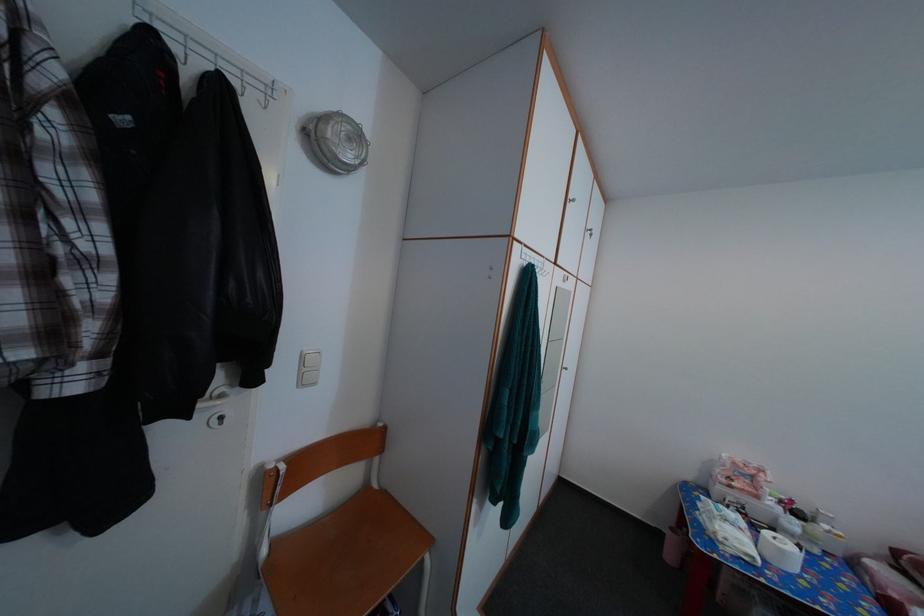
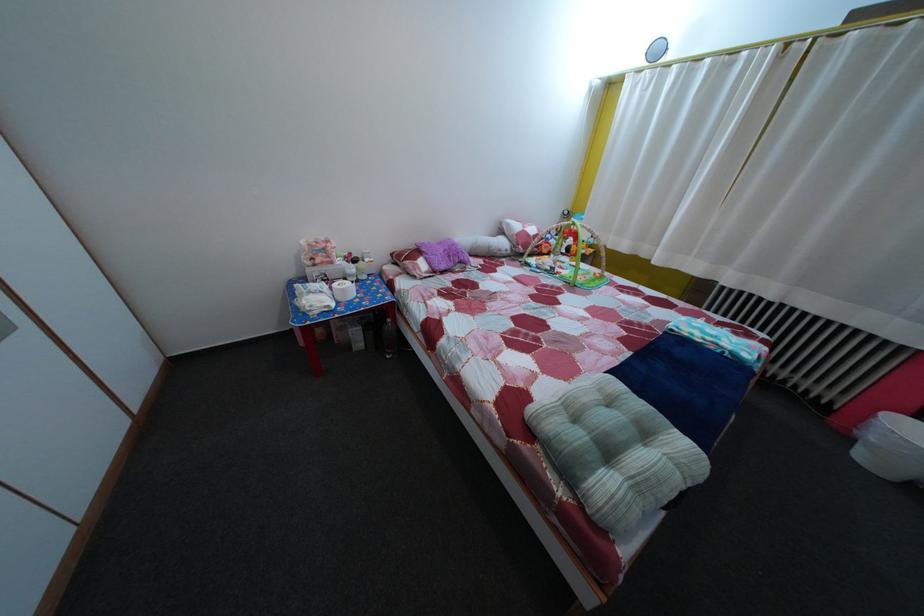
How did the camera likely rotate?

The rotation direction of the camera is right-down.